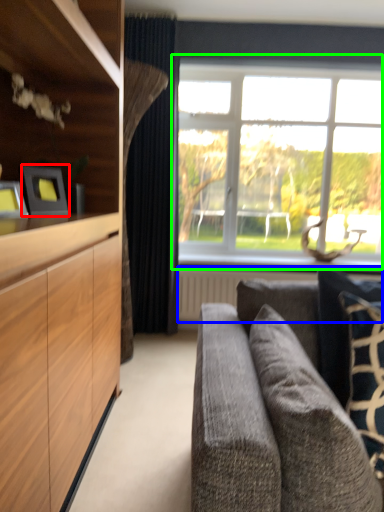
Question: Based on their relative distances, which object is nearer to picture frame (highlighted by a red box)? Choose from radiator (highlighted by a blue box) and window (highlighted by a green box).

Choices:
 (A) radiator
 (B) window

Answer: (A)